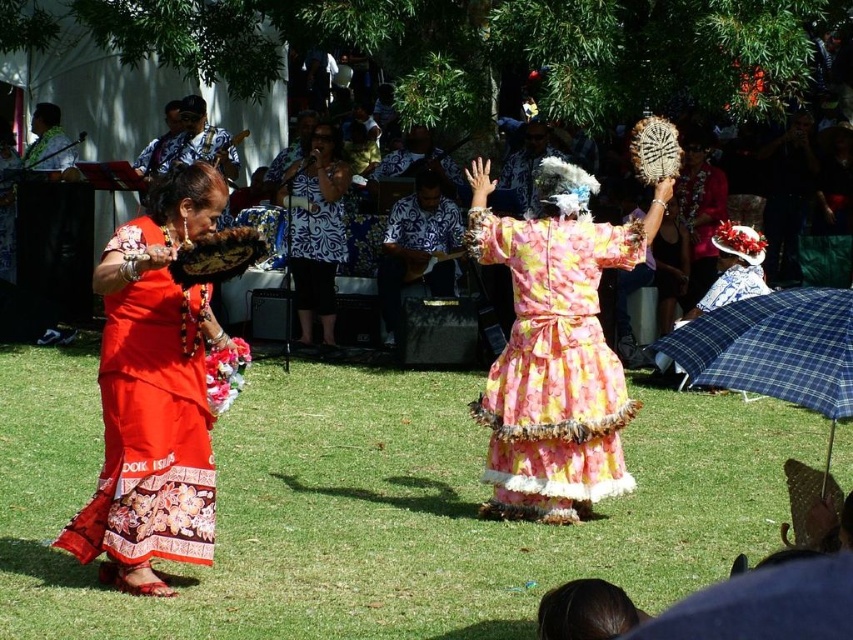
Question: Is floral chiffon dress at center in front of patterned fabric shirt at center?

Choices:
 (A) yes
 (B) no

Answer: (A)

Question: Does green grass at lower center come behind floral chiffon dress at center?

Choices:
 (A) no
 (B) yes

Answer: (A)

Question: Which of these objects is positioned closest to the patterned fabric shirt at center?

Choices:
 (A) matte red dress at left
 (B) floral chiffon dress at center
 (C) green grass at lower center
 (D) blue plaid umbrella at lower right

Answer: (B)

Question: Which object appears closest to the camera in this image?

Choices:
 (A) patterned fabric shirt at center
 (B) floral chiffon dress at center

Answer: (B)

Question: Which of the following is the farthest from the observer?

Choices:
 (A) (593, 456)
 (B) (83, 609)
 (C) (734, 374)

Answer: (A)

Question: Can you confirm if green grass at lower center is wider than floral chiffon dress at center?

Choices:
 (A) yes
 (B) no

Answer: (A)